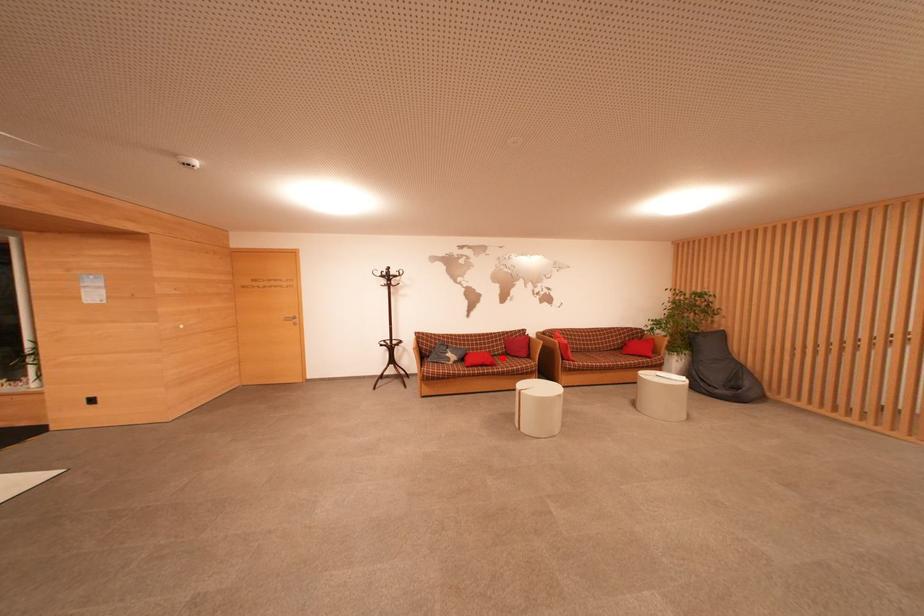
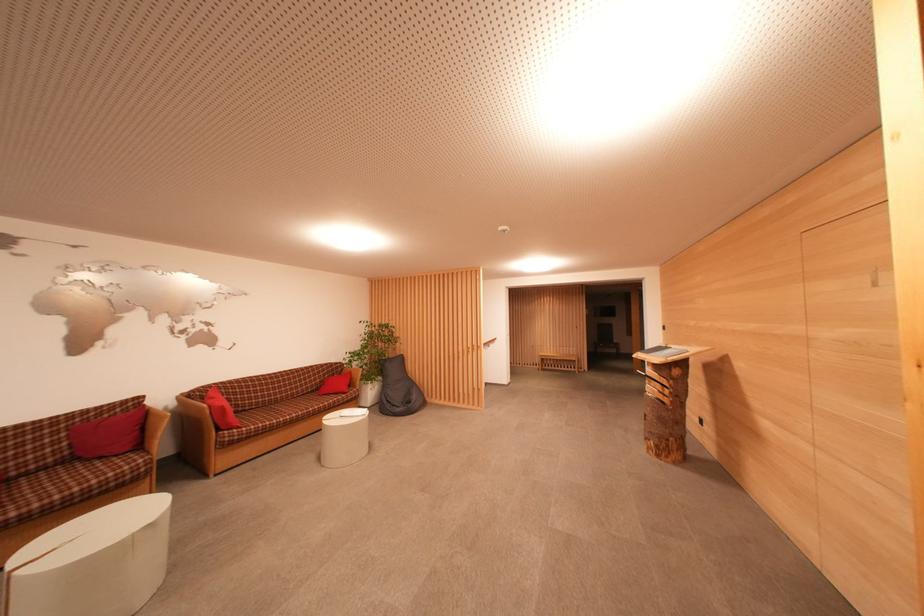
Question: I am providing you with two images of the same scene from different viewpoints. Given a red point in image1, look at the same physical point in image2. Is it:

Choices:
 (A) Closer to the viewpoint
 (B) Farther from the viewpoint

Answer: (A)